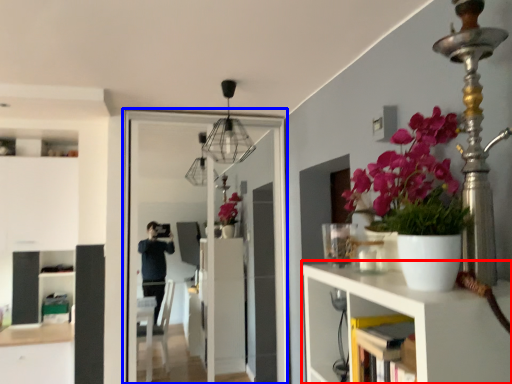
Question: Which of the following is the closest to the observer, shelf (highlighted by a red box) or screen door (highlighted by a blue box)?

Choices:
 (A) shelf
 (B) screen door

Answer: (A)